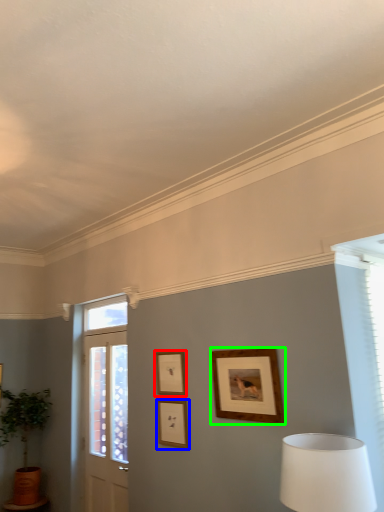
Question: Which is nearer to the picture frame (highlighted by a red box)? picture frame (highlighted by a blue box) or picture frame (highlighted by a green box).

Choices:
 (A) picture frame
 (B) picture frame

Answer: (A)